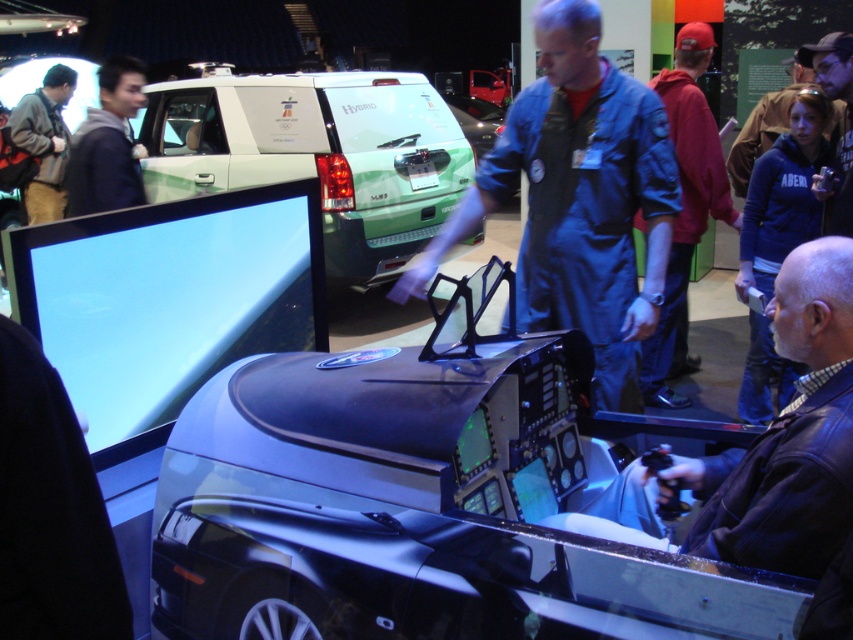
Question: Does shiny black cockpit at center appear on the left side of blue fleece jacket at upper right?

Choices:
 (A) yes
 (B) no

Answer: (A)

Question: Is dark blue hoodie at upper left wider than khaki pants at left?

Choices:
 (A) no
 (B) yes

Answer: (A)

Question: Which of these objects is positioned farthest from the dark blue leather jacket at upper right?

Choices:
 (A) blue denim jumpsuit at center
 (B) dark blue hoodie at upper left
 (C) blue fleece jacket at upper right
 (D) green matte van at center

Answer: (D)

Question: Which point is closer to the camera taking this photo?

Choices:
 (A) (18, 108)
 (B) (490, 140)
 (C) (543, 368)

Answer: (C)

Question: Observing the image, what is the correct spatial positioning of blue denim jumpsuit at center in reference to green matte suv at upper center?

Choices:
 (A) below
 (B) above

Answer: (A)

Question: Based on their relative distances, which object is nearer to the shiny black cockpit at center?

Choices:
 (A) green matte suv at upper center
 (B) dark blue leather jacket at upper right
 (C) khaki pants at left

Answer: (B)